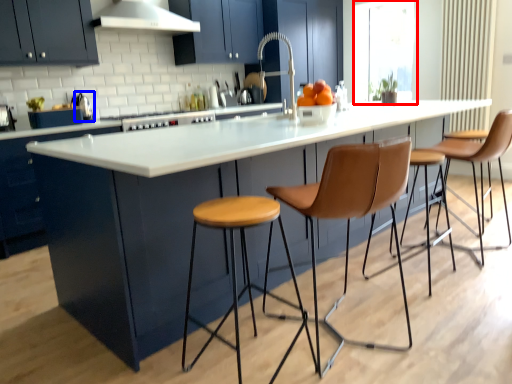
Question: Which object appears farthest to the camera in this image, window screen (highlighted by a red box) or appliance (highlighted by a blue box)?

Choices:
 (A) window screen
 (B) appliance

Answer: (A)